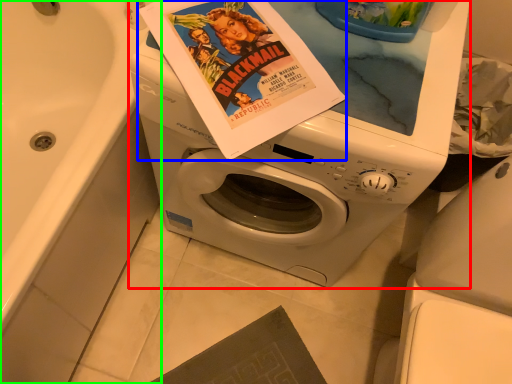
Question: Considering the real-world distances, which object is closest to washing machine (highlighted by a red box)? paperback book (highlighted by a blue box) or bath (highlighted by a green box).

Choices:
 (A) paperback book
 (B) bath

Answer: (A)